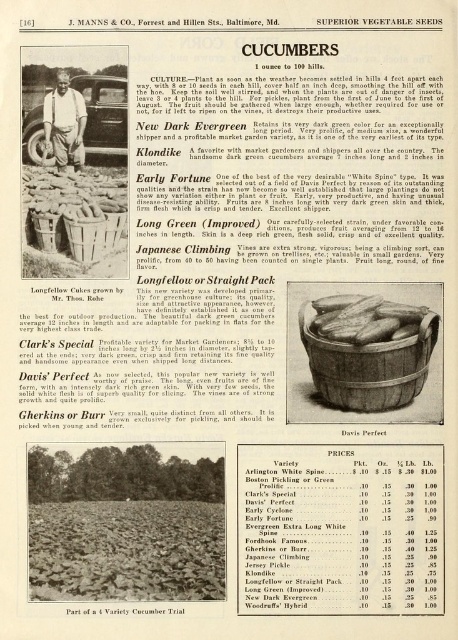
You are a delivery person who needs to place a 12 inch long package between the wooden barrel at center and the wooden at center. Can you fit it there?

The distance between the wooden barrel at center and the wooden at center is 15.50 inches. Since the package is 12 inches long, it can fit in the space between them as 12 is less than 15.50.